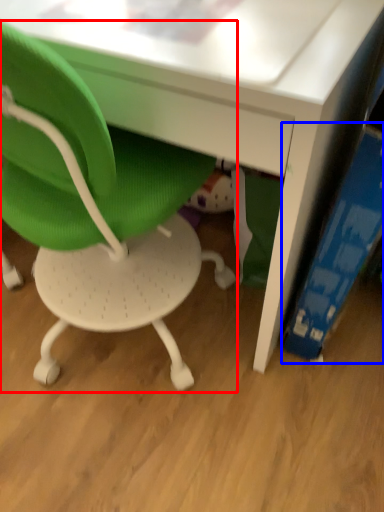
Question: Which point is further to the camera, chair (highlighted by a red box) or paperback book (highlighted by a blue box)?

Choices:
 (A) chair
 (B) paperback book

Answer: (B)